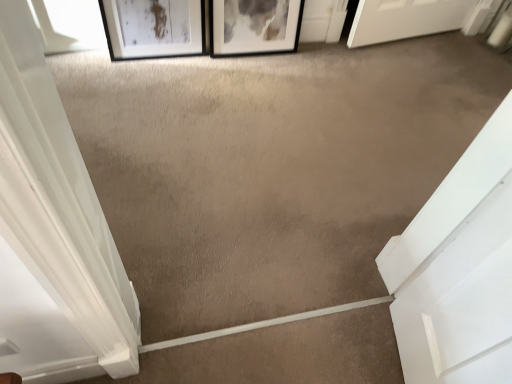
Question: Could you tell me if black matte picture frame at upper center, the first picture frame viewed from the right, is turned towards transparent glass window at upper left?

Choices:
 (A) yes
 (B) no

Answer: (B)

Question: Is black matte picture frame at upper center, the first picture frame viewed from the right, looking in the opposite direction of transparent glass window at upper left?

Choices:
 (A) no
 (B) yes

Answer: (A)

Question: Can you confirm if black matte picture frame at upper center, the first picture frame viewed from the right, is thinner than transparent glass window at upper left?

Choices:
 (A) yes
 (B) no

Answer: (B)

Question: Does black matte picture frame at upper center, the 2th picture frame from the left, have a smaller size compared to transparent glass window at upper left?

Choices:
 (A) yes
 (B) no

Answer: (B)

Question: Is black matte picture frame at upper center, the first picture frame viewed from the right, taller than transparent glass window at upper left?

Choices:
 (A) no
 (B) yes

Answer: (B)

Question: From the image's perspective, is black matte picture frame at upper center, the 2th picture frame from the left, located above transparent glass window at upper left?

Choices:
 (A) no
 (B) yes

Answer: (B)

Question: Does black matte picture frame at upper center, the 2th picture frame from the left, have a larger size compared to matte black picture frame at upper left, which is the first picture frame in left-to-right order?

Choices:
 (A) no
 (B) yes

Answer: (B)

Question: Are black matte picture frame at upper center, the 2th picture frame from the left, and matte black picture frame at upper left, which is the first picture frame in left-to-right order, making contact?

Choices:
 (A) yes
 (B) no

Answer: (B)

Question: Can we say black matte picture frame at upper center, the 2th picture frame from the left, lies outside matte black picture frame at upper left, which is the first picture frame in left-to-right order?

Choices:
 (A) yes
 (B) no

Answer: (A)

Question: From a real-world perspective, is black matte picture frame at upper center, the first picture frame viewed from the right, located higher than matte black picture frame at upper left, acting as the second picture frame starting from the right?

Choices:
 (A) no
 (B) yes

Answer: (A)

Question: From the image's perspective, is black matte picture frame at upper center, the 2th picture frame from the left, below matte black picture frame at upper left, which is the first picture frame in left-to-right order?

Choices:
 (A) yes
 (B) no

Answer: (B)

Question: Considering the relative sizes of black matte picture frame at upper center, the first picture frame viewed from the right, and matte black picture frame at upper left, which is the first picture frame in left-to-right order, in the image provided, is black matte picture frame at upper center, the first picture frame viewed from the right, shorter than matte black picture frame at upper left, which is the first picture frame in left-to-right order,?

Choices:
 (A) no
 (B) yes

Answer: (B)

Question: Does transparent glass window at upper left come in front of black matte picture frame at upper center, the first picture frame viewed from the right?

Choices:
 (A) yes
 (B) no

Answer: (A)